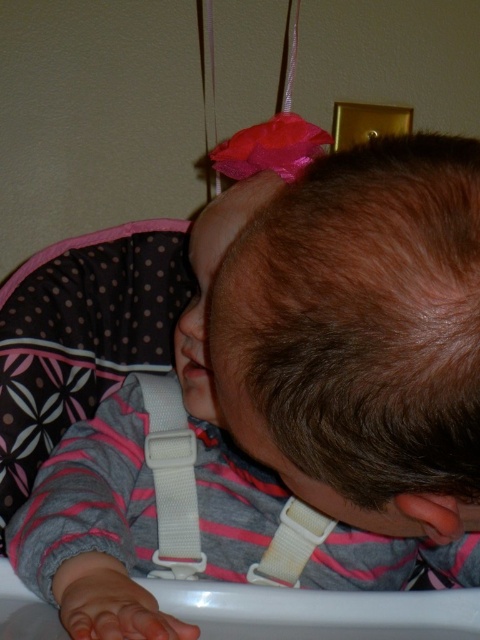
Measure the distance between brown matte hair at center and camera.

They are 10.14 inches apart.

Who is lower down, brown matte hair at center or white fabric strap at center?

white fabric strap at center is lower down.

Locate an element on the screen. The height and width of the screenshot is (640, 480). brown matte hair at center is located at coordinates (360, 333).